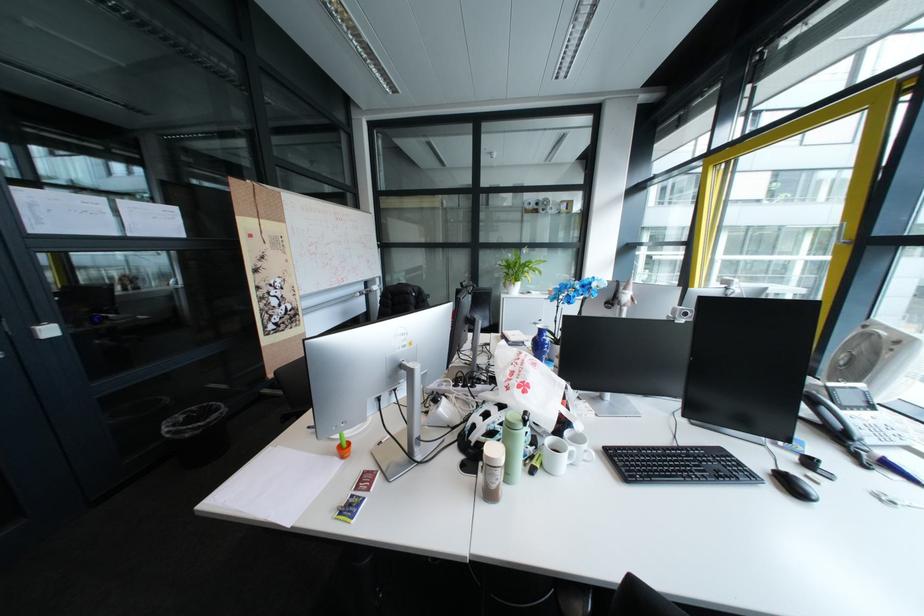
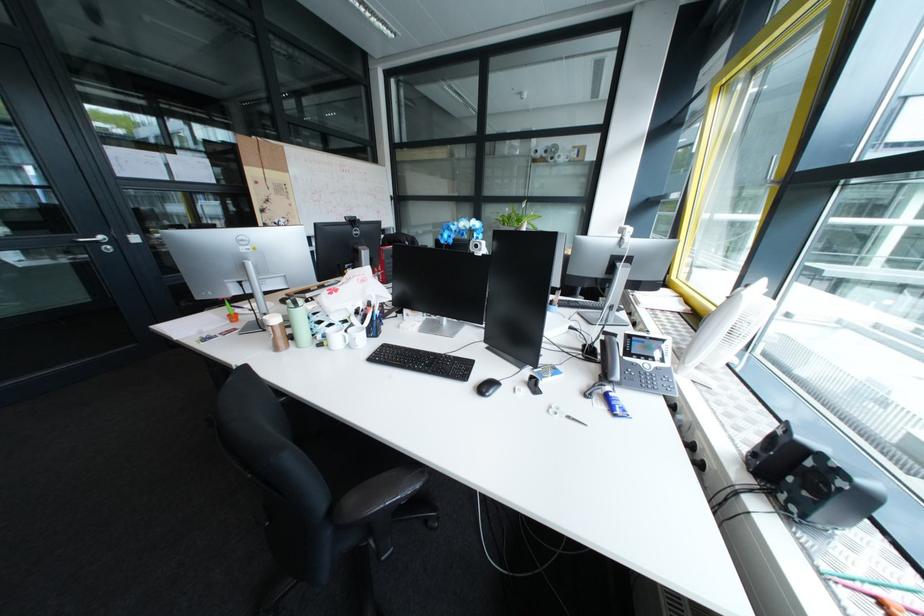
Locate, in the second image, the point that corresponds to pixel 889 499 in the first image.

(560, 408)